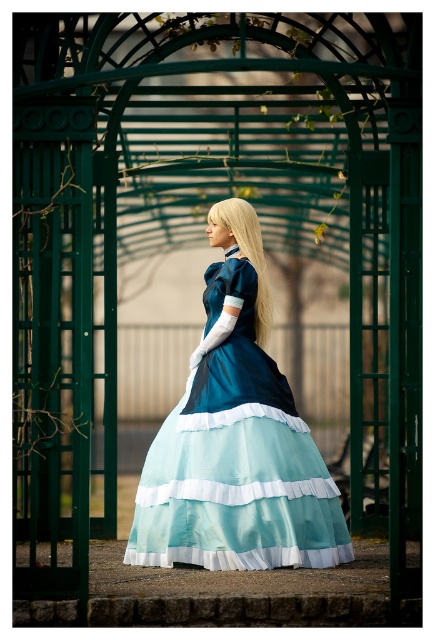
Question: Which point is farther from the camera taking this photo?

Choices:
 (A) (220, 204)
 (B) (198, 486)

Answer: (A)

Question: Does matte blue dress at center have a lesser width compared to blonde silky hair at center?

Choices:
 (A) no
 (B) yes

Answer: (A)

Question: Where is matte blue dress at center located in relation to blonde silky hair at center in the image?

Choices:
 (A) left
 (B) right

Answer: (A)

Question: Is matte blue dress at center wider than blonde silky hair at center?

Choices:
 (A) no
 (B) yes

Answer: (B)